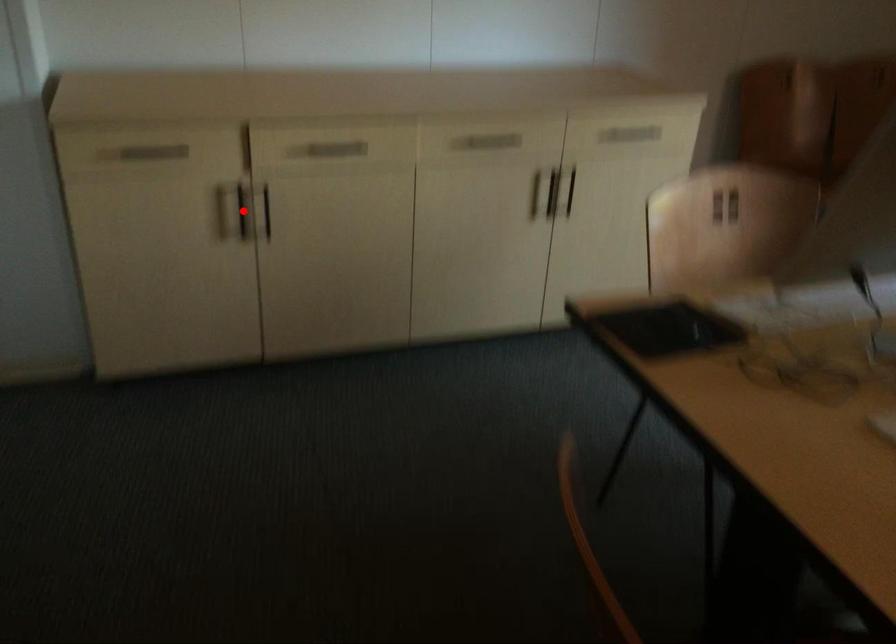
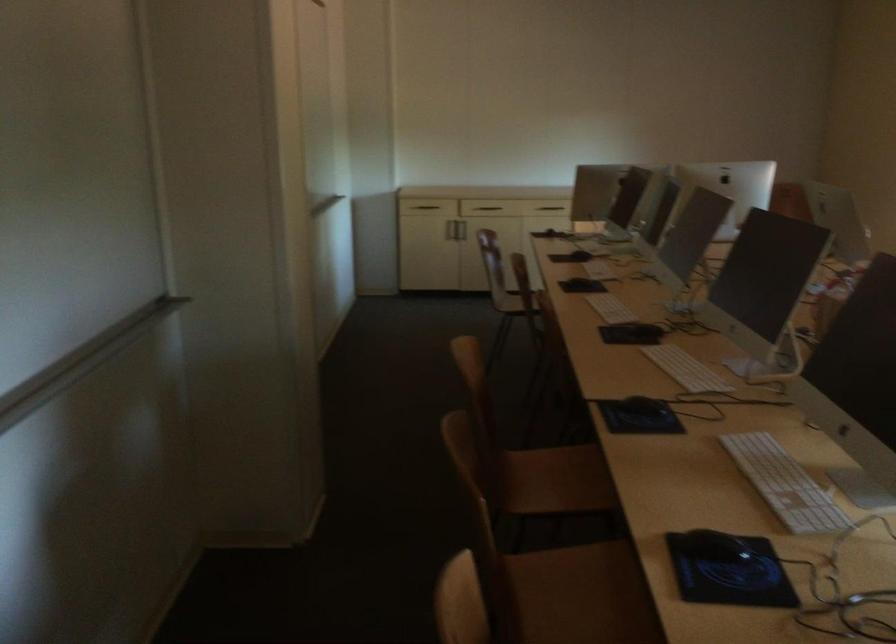
In the second image, find the point that corresponds to the highlighted location in the first image.

(455, 213)